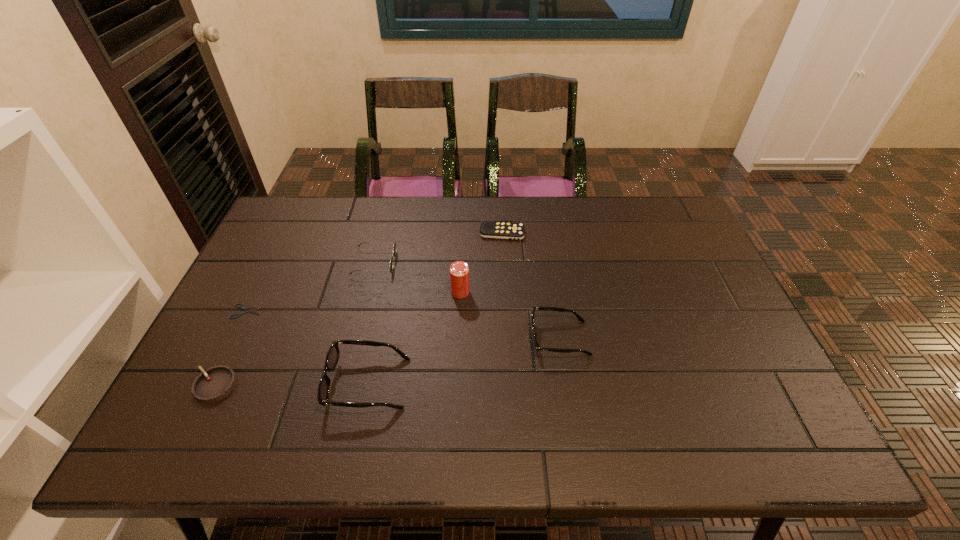
You are a GUI agent. You are given a task and a screenshot of the screen. Output one action in this format:
    pyautogui.click(x=<x>, y=<y>)
    Task: Click on the vacant space that is in between the ashtray and the shorter spectacles
    The image size is (960, 540).
    Given the screenshot: What is the action you would take?
    pyautogui.click(x=388, y=362)

Where is `free space between the tallest object and the remote control`? Image resolution: width=960 pixels, height=540 pixels. free space between the tallest object and the remote control is located at coordinates (481, 262).

Image resolution: width=960 pixels, height=540 pixels. I want to click on vacant space that's between the shortest object and the ashtray, so click(231, 348).

Locate an element on the screen. The height and width of the screenshot is (540, 960). free space that is in between the ashtray and the farthest object is located at coordinates 359,309.

Identify the location of vacant region between the right spectacles and the left spectacles. [x=464, y=361].

I want to click on the second closest object to the taller spectacles, so click(x=215, y=383).

Identify the location of object that is the closest to the tallest object. Image resolution: width=960 pixels, height=540 pixels. (537, 347).

Find the location of `vacant space that satisfies the following two spatial constraints: 1. on the lenses of the sixth shortest object; 2. on the front side of the ashtray`. vacant space that satisfies the following two spatial constraints: 1. on the lenses of the sixth shortest object; 2. on the front side of the ashtray is located at coordinates (368, 386).